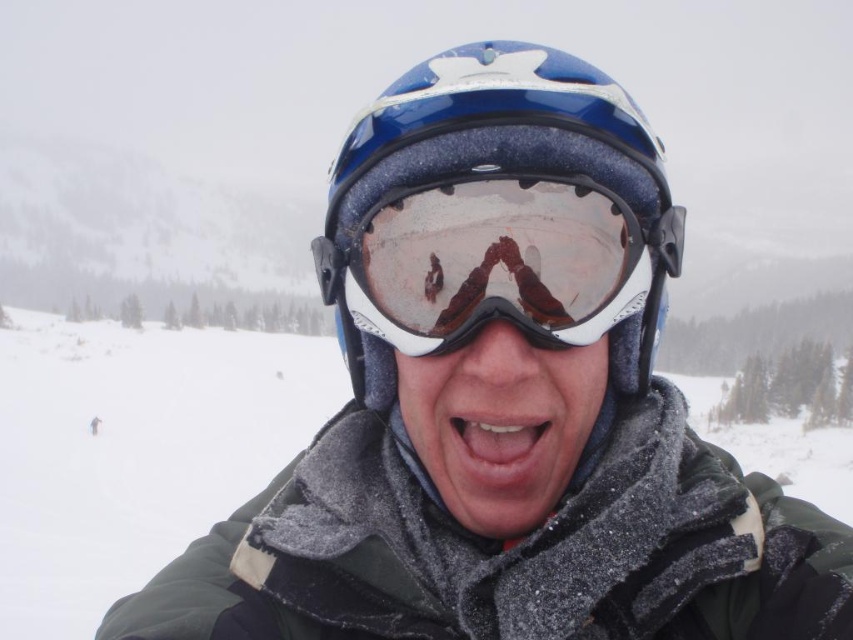
You are a photographer trying to capture the reflection in the transparent plastic goggles at center. To ensure the reflection of the smooth skin mouth at center is visible, where should you position your camera relative to the goggles?

The transparent plastic goggles at center is above the smooth skin mouth at center, so positioning the camera below the goggles would allow the reflection of the smooth skin mouth at center to be visible in the goggles.

You are standing at the base of a ski slope and see the point marked at coordinates point [531,328]. If you want to ski to that point, how far will you have to travel?

The distance of point [531,328] from viewer is 5.54 meters, so you will have to travel 5.54 meters to reach that point.